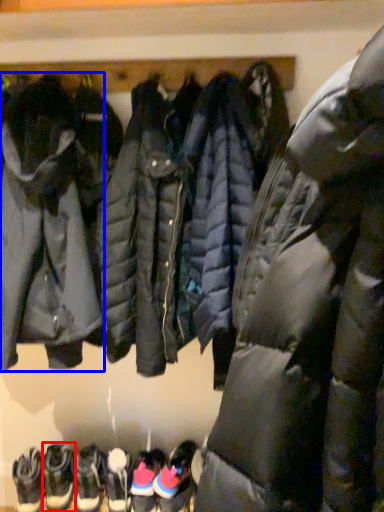
Question: Which object is further to the camera taking this photo, footwear (highlighted by a red box) or jacket (highlighted by a blue box)?

Choices:
 (A) footwear
 (B) jacket

Answer: (A)